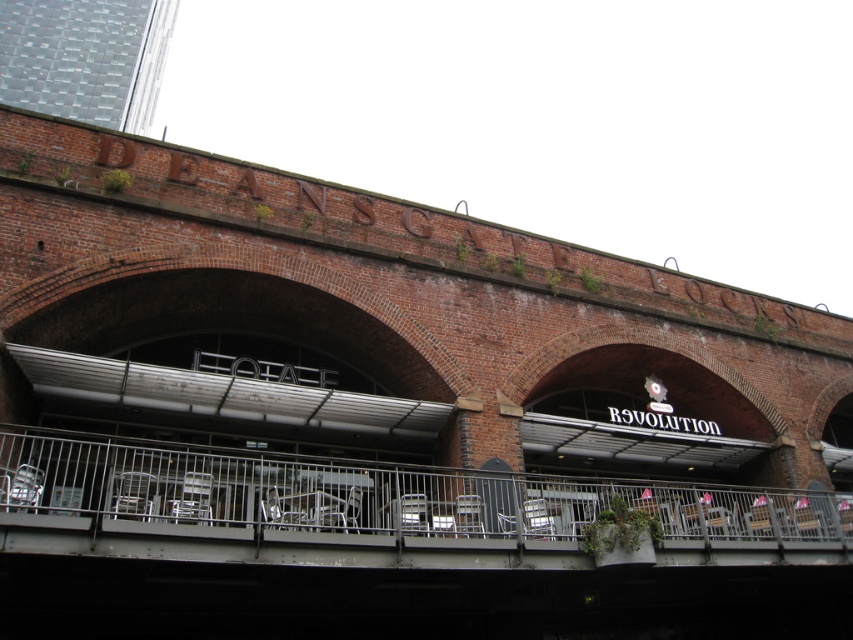
Is brick at center above metallic gray railing at center?

Yes, brick at center is above metallic gray railing at center.

Between brick at center and metallic gray railing at center, which one is positioned higher?

brick at center

At what (x,y) coordinates should I click in order to perform the action: click on brick at center. Please return your answer as a coordinate pair (x, y). The image size is (853, 640). Looking at the image, I should click on (387, 368).